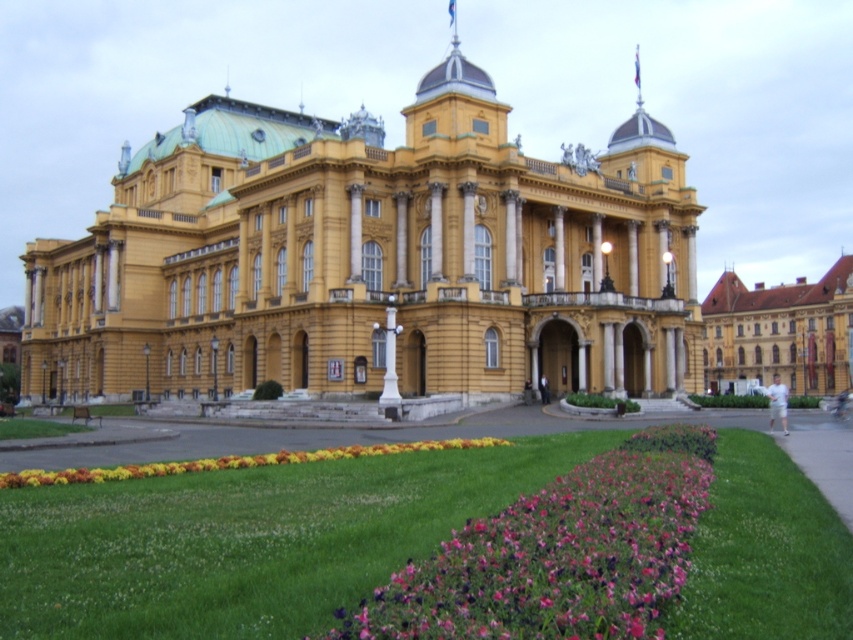
From the picture: Can you confirm if green grass at lower center is taller than purple matte flowers at lower center?

No, green grass at lower center is not taller than purple matte flowers at lower center.

Can you confirm if green grass at lower center is positioned below purple matte flowers at lower center?

Yes.

Between point (165, 529) and point (428, 560), which one is positioned in front?

Point (428, 560) is in front.

Identify the location of green grass at lower center. (248, 540).

Between green grass at lower center and brown textured building at right, which one has more height?

With more height is brown textured building at right.

Does green grass at lower center appear on the left side of brown textured building at right?

Yes, green grass at lower center is to the left of brown textured building at right.

Describe the element at coordinates (248, 540) in the screenshot. I see `green grass at lower center` at that location.

Locate an element on the screen. green grass at lower center is located at coordinates (248, 540).

Is yellow stone building at center shorter than multicolored fabric flower bed at lower center?

In fact, yellow stone building at center may be taller than multicolored fabric flower bed at lower center.

Does yellow stone building at center have a greater height compared to multicolored fabric flower bed at lower center?

Yes, yellow stone building at center is taller than multicolored fabric flower bed at lower center.

Which is in front, point (195, 154) or point (253, 467)?

Point (253, 467)

Where is `yellow stone building at center`? This screenshot has height=640, width=853. yellow stone building at center is located at coordinates tap(373, 259).